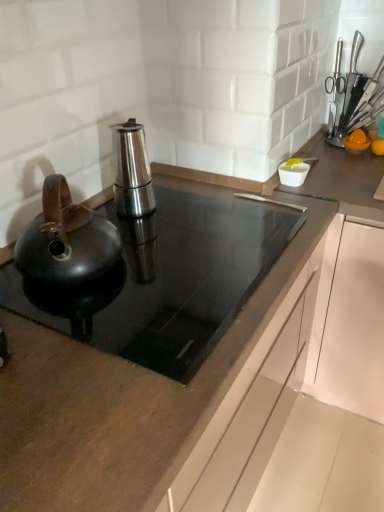
Where is `shiny black kettle at left, marked as the first kitchen appliance in a front-to-back arrangement`? The image size is (384, 512). shiny black kettle at left, marked as the first kitchen appliance in a front-to-back arrangement is located at coordinates (66, 240).

What do you see at coordinates (164, 281) in the screenshot? This screenshot has height=512, width=384. I see `black glass cooktop at center` at bounding box center [164, 281].

You are a GUI agent. You are given a task and a screenshot of the screen. Output one action in this format:
    pyautogui.click(x=<x>, y=<y>)
    Task: Click on the stainless steel espresso maker at center, which is the 1th kitchen appliance in back-to-front order
    Image resolution: width=384 pixels, height=512 pixels.
    Given the screenshot: What is the action you would take?
    pyautogui.click(x=131, y=170)

How many degrees apart are the facing directions of shiny black kettle at left, positioned as the second kitchen appliance in back-to-front order, and black glass cooktop at center?

There is a 0.000423-degree angle between the facing directions of shiny black kettle at left, positioned as the second kitchen appliance in back-to-front order, and black glass cooktop at center.

Is shiny black kettle at left, positioned as the second kitchen appliance in back-to-front order, in contact with black glass cooktop at center?

No, shiny black kettle at left, positioned as the second kitchen appliance in back-to-front order, is not with black glass cooktop at center.

Considering the sizes of objects shiny black kettle at left, marked as the first kitchen appliance in a front-to-back arrangement, and black glass cooktop at center in the image provided, who is taller, shiny black kettle at left, marked as the first kitchen appliance in a front-to-back arrangement, or black glass cooktop at center?

Standing taller between the two is shiny black kettle at left, marked as the first kitchen appliance in a front-to-back arrangement.

Image resolution: width=384 pixels, height=512 pixels. Find the location of `gas stove that appears below the shiny black kettle at left, positioned as the second kitchen appliance in back-to-front order (from a real-world perspective)`. gas stove that appears below the shiny black kettle at left, positioned as the second kitchen appliance in back-to-front order (from a real-world perspective) is located at coordinates (164, 281).

Does shiny black kettle at left, positioned as the second kitchen appliance in back-to-front order, turn towards stainless steel espresso maker at center, positioned as the second kitchen appliance in front-to-back order?

No, shiny black kettle at left, positioned as the second kitchen appliance in back-to-front order, does not turn towards stainless steel espresso maker at center, positioned as the second kitchen appliance in front-to-back order.

Is stainless steel espresso maker at center, which is the 1th kitchen appliance in back-to-front order, a part of shiny black kettle at left, positioned as the second kitchen appliance in back-to-front order?

No, shiny black kettle at left, positioned as the second kitchen appliance in back-to-front order, does not contain stainless steel espresso maker at center, which is the 1th kitchen appliance in back-to-front order.

Considering the relative sizes of shiny black kettle at left, marked as the first kitchen appliance in a front-to-back arrangement, and stainless steel espresso maker at center, which is the 1th kitchen appliance in back-to-front order, in the image provided, is shiny black kettle at left, marked as the first kitchen appliance in a front-to-back arrangement, smaller than stainless steel espresso maker at center, which is the 1th kitchen appliance in back-to-front order,?

No.

Considering the positions of objects shiny black kettle at left, positioned as the second kitchen appliance in back-to-front order, and stainless steel espresso maker at center, which is the 1th kitchen appliance in back-to-front order, in the image provided, who is in front, shiny black kettle at left, positioned as the second kitchen appliance in back-to-front order, or stainless steel espresso maker at center, which is the 1th kitchen appliance in back-to-front order,?

Positioned in front is shiny black kettle at left, positioned as the second kitchen appliance in back-to-front order.

From the image's perspective, which is above, stainless steel espresso maker at center, positioned as the second kitchen appliance in front-to-back order, or shiny black kettle at left, positioned as the second kitchen appliance in back-to-front order?

From the image's view, stainless steel espresso maker at center, positioned as the second kitchen appliance in front-to-back order, is above.

Relative to shiny black kettle at left, positioned as the second kitchen appliance in back-to-front order, is stainless steel espresso maker at center, which is the 1th kitchen appliance in back-to-front order, in front or behind?

Clearly, stainless steel espresso maker at center, which is the 1th kitchen appliance in back-to-front order, is behind shiny black kettle at left, positioned as the second kitchen appliance in back-to-front order.

Considering the relative positions of stainless steel espresso maker at center, positioned as the second kitchen appliance in front-to-back order, and shiny black kettle at left, marked as the first kitchen appliance in a front-to-back arrangement, in the image provided, is stainless steel espresso maker at center, positioned as the second kitchen appliance in front-to-back order, to the left of shiny black kettle at left, marked as the first kitchen appliance in a front-to-back arrangement, from the viewer's perspective?

Incorrect, stainless steel espresso maker at center, positioned as the second kitchen appliance in front-to-back order, is not on the left side of shiny black kettle at left, marked as the first kitchen appliance in a front-to-back arrangement.

Is stainless steel espresso maker at center, positioned as the second kitchen appliance in front-to-back order, outside of shiny black kettle at left, positioned as the second kitchen appliance in back-to-front order?

stainless steel espresso maker at center, positioned as the second kitchen appliance in front-to-back order, lies outside shiny black kettle at left, positioned as the second kitchen appliance in back-to-front order,'s area.

Looking at this image, from the image's perspective, is shiny black kettle at left, marked as the first kitchen appliance in a front-to-back arrangement, below metallic knife block at upper right?

Correct, shiny black kettle at left, marked as the first kitchen appliance in a front-to-back arrangement, appears lower than metallic knife block at upper right in the image.

Between shiny black kettle at left, positioned as the second kitchen appliance in back-to-front order, and metallic knife block at upper right, which one appears on the left side from the viewer's perspective?

shiny black kettle at left, positioned as the second kitchen appliance in back-to-front order.

Does point (57, 258) come farther from viewer compared to point (350, 112)?

No, (57, 258) is in front of (350, 112).

Consider the image. Considering the sizes of objects shiny black kettle at left, positioned as the second kitchen appliance in back-to-front order, and metallic knife block at upper right in the image provided, who is wider, shiny black kettle at left, positioned as the second kitchen appliance in back-to-front order, or metallic knife block at upper right?

With larger width is shiny black kettle at left, positioned as the second kitchen appliance in back-to-front order.

Between stainless steel espresso maker at center, positioned as the second kitchen appliance in front-to-back order, and metallic knife block at upper right, which one has smaller size?

With smaller size is metallic knife block at upper right.

From the image's perspective, is stainless steel espresso maker at center, positioned as the second kitchen appliance in front-to-back order, above metallic knife block at upper right?

No, from the image's perspective, stainless steel espresso maker at center, positioned as the second kitchen appliance in front-to-back order, is not over metallic knife block at upper right.

From a real-world perspective, which object stands above the other?

metallic knife block at upper right, from a real-world perspective.

Which object is closer to the camera, stainless steel espresso maker at center, which is the 1th kitchen appliance in back-to-front order, or metallic knife block at upper right?

stainless steel espresso maker at center, which is the 1th kitchen appliance in back-to-front order, is in front.

Does black glass cooktop at center have a lesser height compared to stainless steel espresso maker at center, which is the 1th kitchen appliance in back-to-front order?

Correct, black glass cooktop at center is not as tall as stainless steel espresso maker at center, which is the 1th kitchen appliance in back-to-front order.

Are black glass cooktop at center and stainless steel espresso maker at center, which is the 1th kitchen appliance in back-to-front order, located far from each other?

No, there isn't a large distance between black glass cooktop at center and stainless steel espresso maker at center, which is the 1th kitchen appliance in back-to-front order.

Is black glass cooktop at center turned away from stainless steel espresso maker at center, positioned as the second kitchen appliance in front-to-back order?

black glass cooktop at center does not have its back to stainless steel espresso maker at center, positioned as the second kitchen appliance in front-to-back order.

Who is taller, stainless steel espresso maker at center, positioned as the second kitchen appliance in front-to-back order, or black glass cooktop at center?

stainless steel espresso maker at center, positioned as the second kitchen appliance in front-to-back order.

Considering the relative sizes of stainless steel espresso maker at center, positioned as the second kitchen appliance in front-to-back order, and black glass cooktop at center in the image provided, is stainless steel espresso maker at center, positioned as the second kitchen appliance in front-to-back order, smaller than black glass cooktop at center?

Yes, stainless steel espresso maker at center, positioned as the second kitchen appliance in front-to-back order, is smaller than black glass cooktop at center.

The image size is (384, 512). In order to click on gas stove below the stainless steel espresso maker at center, positioned as the second kitchen appliance in front-to-back order (from a real-world perspective) in this screenshot , I will do `click(164, 281)`.

From a real-world perspective, is stainless steel espresso maker at center, positioned as the second kitchen appliance in front-to-back order, physically below black glass cooktop at center?

No, from a real-world perspective, stainless steel espresso maker at center, positioned as the second kitchen appliance in front-to-back order, is not below black glass cooktop at center.

Identify the location of gas stove located underneath the shiny black kettle at left, marked as the first kitchen appliance in a front-to-back arrangement (from a real-world perspective). Image resolution: width=384 pixels, height=512 pixels. (164, 281).

At what (x,y) coordinates should I click in order to perform the action: click on kitchen appliance in front of the stainless steel espresso maker at center, positioned as the second kitchen appliance in front-to-back order. Please return your answer as a coordinate pair (x, y). Image resolution: width=384 pixels, height=512 pixels. Looking at the image, I should click on (66, 240).

Looking at the image, which one is located further to black glass cooktop at center, shiny black kettle at left, marked as the first kitchen appliance in a front-to-back arrangement, or stainless steel espresso maker at center, which is the 1th kitchen appliance in back-to-front order?

stainless steel espresso maker at center, which is the 1th kitchen appliance in back-to-front order, is further to black glass cooktop at center.

Which object lies nearer to the anchor point shiny black kettle at left, positioned as the second kitchen appliance in back-to-front order, black glass cooktop at center or metallic knife block at upper right?

black glass cooktop at center.

Looking at the image, which one is located further to black glass cooktop at center, shiny black kettle at left, positioned as the second kitchen appliance in back-to-front order, or metallic knife block at upper right?

Based on the image, metallic knife block at upper right appears to be further to black glass cooktop at center.

Looking at this image, when comparing their distances from metallic knife block at upper right, does black glass cooktop at center or stainless steel espresso maker at center, positioned as the second kitchen appliance in front-to-back order, seem further?

black glass cooktop at center is further to metallic knife block at upper right.

From the image, which object appears to be farther from metallic knife block at upper right, shiny black kettle at left, positioned as the second kitchen appliance in back-to-front order, or black glass cooktop at center?

The object further to metallic knife block at upper right is shiny black kettle at left, positioned as the second kitchen appliance in back-to-front order.

From the image, which object appears to be farther from shiny black kettle at left, marked as the first kitchen appliance in a front-to-back arrangement, black glass cooktop at center or stainless steel espresso maker at center, positioned as the second kitchen appliance in front-to-back order?

stainless steel espresso maker at center, positioned as the second kitchen appliance in front-to-back order.

Looking at the image, which one is located closer to metallic knife block at upper right, stainless steel espresso maker at center, which is the 1th kitchen appliance in back-to-front order, or black glass cooktop at center?

Answer: stainless steel espresso maker at center, which is the 1th kitchen appliance in back-to-front order, is positioned closer to the anchor metallic knife block at upper right.

Which object lies nearer to the anchor point black glass cooktop at center, stainless steel espresso maker at center, which is the 1th kitchen appliance in back-to-front order, or metallic knife block at upper right?

The object closer to black glass cooktop at center is stainless steel espresso maker at center, which is the 1th kitchen appliance in back-to-front order.

This screenshot has height=512, width=384. I want to click on gas stove located between shiny black kettle at left, marked as the first kitchen appliance in a front-to-back arrangement, and metallic knife block at upper right in the left-right direction, so click(x=164, y=281).

Identify the location of kitchen appliance between shiny black kettle at left, positioned as the second kitchen appliance in back-to-front order, and metallic knife block at upper right from left to right. (131, 170).

This screenshot has height=512, width=384. Identify the location of kitchen appliance between black glass cooktop at center and stainless steel espresso maker at center, which is the 1th kitchen appliance in back-to-front order, along the z-axis. (66, 240).

You are a GUI agent. You are given a task and a screenshot of the screen. Output one action in this format:
    pyautogui.click(x=<x>, y=<y>)
    Task: Click on the gas stove between stainless steel espresso maker at center, which is the 1th kitchen appliance in back-to-front order, and metallic knife block at upper right from left to right
    This screenshot has width=384, height=512.
    Given the screenshot: What is the action you would take?
    pyautogui.click(x=164, y=281)